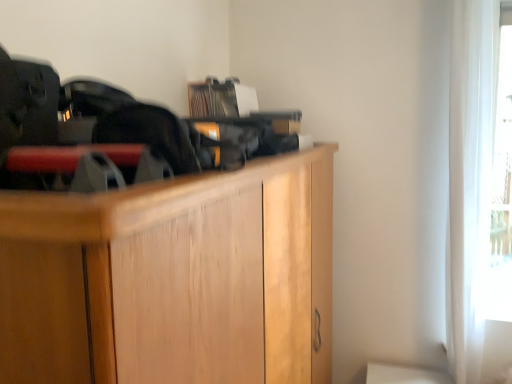
Question: Is light brown wood cabinet at center positioned in front of white sheer curtain at right?

Choices:
 (A) no
 (B) yes

Answer: (B)

Question: Is light brown wood cabinet at center to the left of white sheer curtain at right from the viewer's perspective?

Choices:
 (A) yes
 (B) no

Answer: (A)

Question: From a real-world perspective, is light brown wood cabinet at center located beneath white sheer curtain at right?

Choices:
 (A) yes
 (B) no

Answer: (A)

Question: Is light brown wood cabinet at center further to the viewer compared to white sheer curtain at right?

Choices:
 (A) yes
 (B) no

Answer: (B)

Question: From the image's perspective, is light brown wood cabinet at center on top of white sheer curtain at right?

Choices:
 (A) no
 (B) yes

Answer: (A)

Question: Does light brown wood cabinet at center have a larger size compared to white sheer curtain at right?

Choices:
 (A) no
 (B) yes

Answer: (B)

Question: From a real-world perspective, does white sheer curtain at right sit lower than light brown wood cabinet at center?

Choices:
 (A) yes
 (B) no

Answer: (B)

Question: Is the depth of white sheer curtain at right greater than that of light brown wood cabinet at center?

Choices:
 (A) no
 (B) yes

Answer: (B)

Question: From the image's perspective, is white sheer curtain at right beneath light brown wood cabinet at center?

Choices:
 (A) yes
 (B) no

Answer: (B)

Question: Considering the relative sizes of white sheer curtain at right and light brown wood cabinet at center in the image provided, is white sheer curtain at right smaller than light brown wood cabinet at center?

Choices:
 (A) no
 (B) yes

Answer: (B)

Question: Can you confirm if white sheer curtain at right is thinner than light brown wood cabinet at center?

Choices:
 (A) no
 (B) yes

Answer: (B)

Question: Can you confirm if white sheer curtain at right is shorter than light brown wood cabinet at center?

Choices:
 (A) yes
 (B) no

Answer: (B)

Question: From their relative heights in the image, would you say light brown wood cabinet at center is taller or shorter than white sheer curtain at right?

Choices:
 (A) short
 (B) tall

Answer: (A)